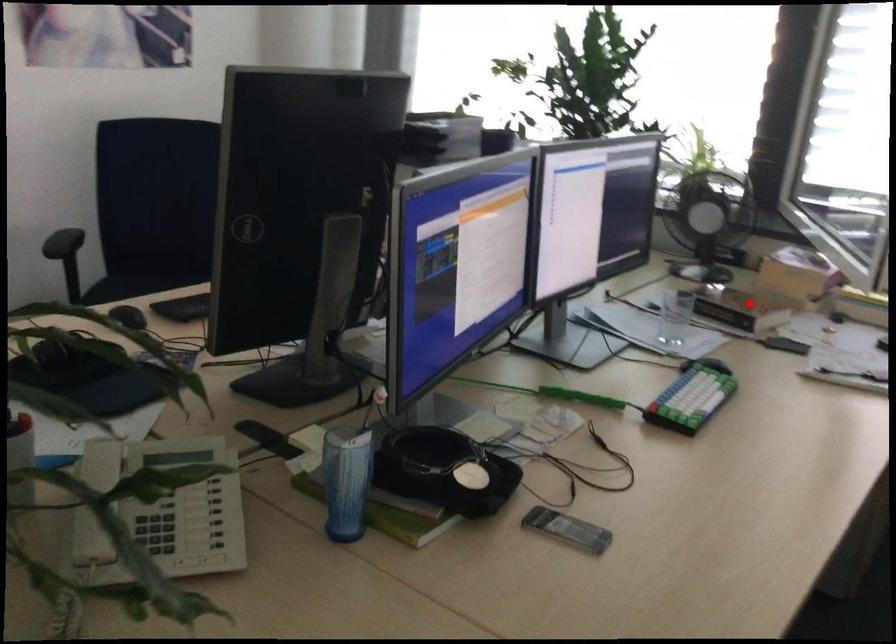
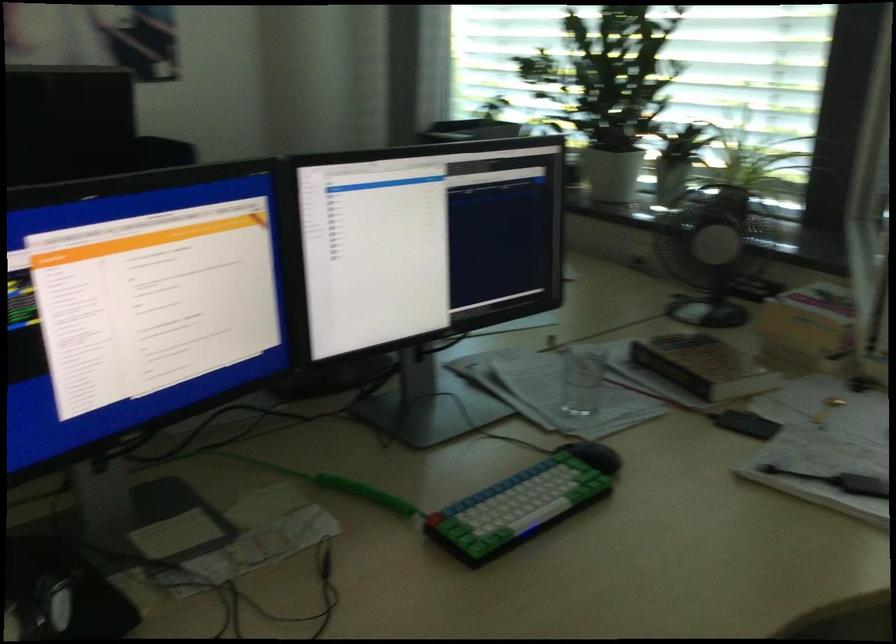
Locate, in the second image, the point that corresponds to the highlighted location in the first image.

(703, 366)